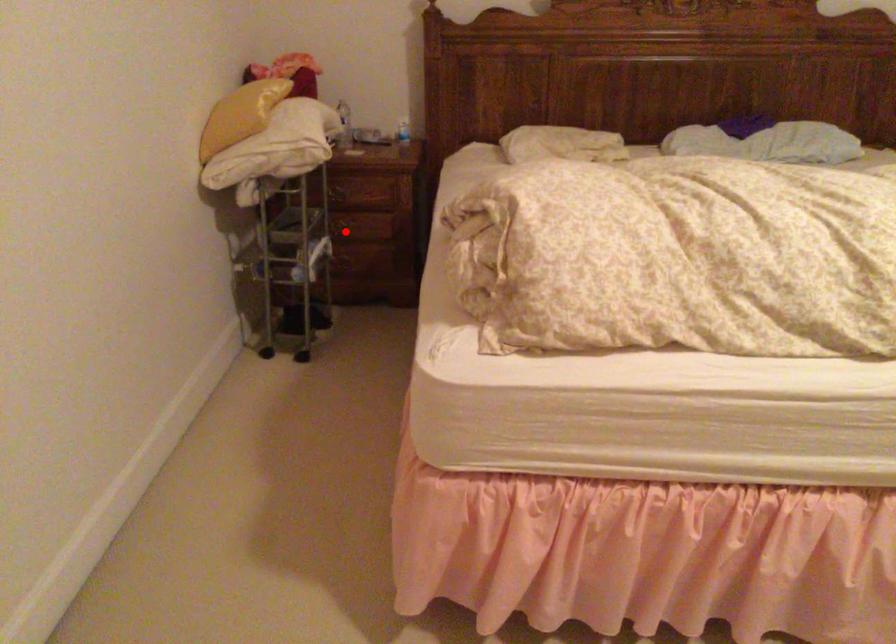
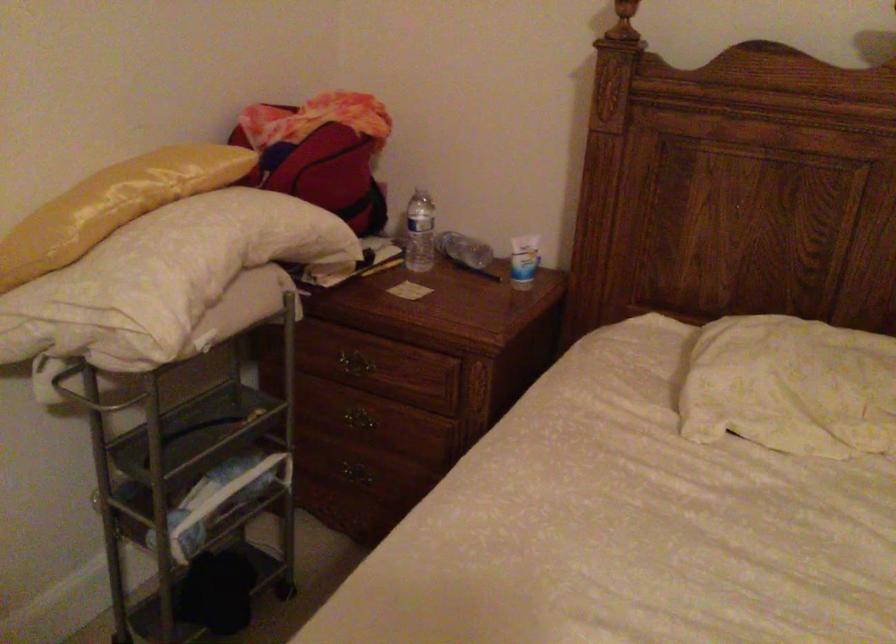
Question: I am providing you with two images of the same scene from different viewpoints. Image1 has a red point marked. In image2, the corresponding 3D location appears at what relative position? Reply with the corresponding letter.

Choices:
 (A) Closer
 (B) Farther

Answer: (A)